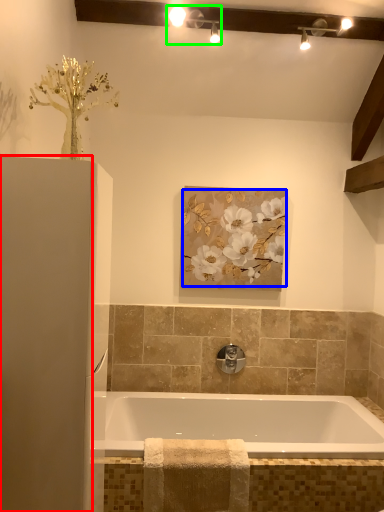
Question: Considering the real-world distances, which object is farthest from screen door (highlighted by a red box)? floral arrangement (highlighted by a blue box) or light fixture (highlighted by a green box)?

Choices:
 (A) floral arrangement
 (B) light fixture

Answer: (B)